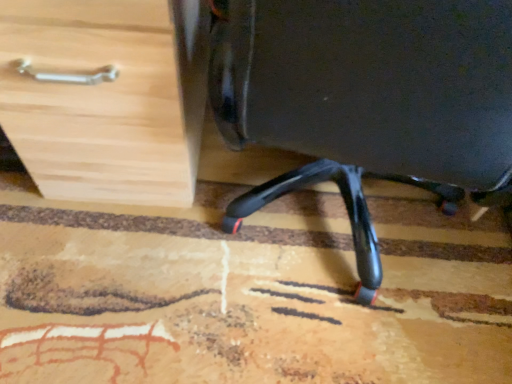
In order to face black plastic chair leg at lower center, should I rotate leftwards or rightwards?

It's best to rotate right around 14.698 degrees.

Identify the location of black plastic chair leg at lower center. The height and width of the screenshot is (384, 512). (362, 97).

This screenshot has width=512, height=384. What do you see at coordinates (362, 97) in the screenshot?
I see `black plastic chair leg at lower center` at bounding box center [362, 97].

Identify the location of black plastic chair leg at lower center. The width and height of the screenshot is (512, 384). pyautogui.click(x=362, y=97).